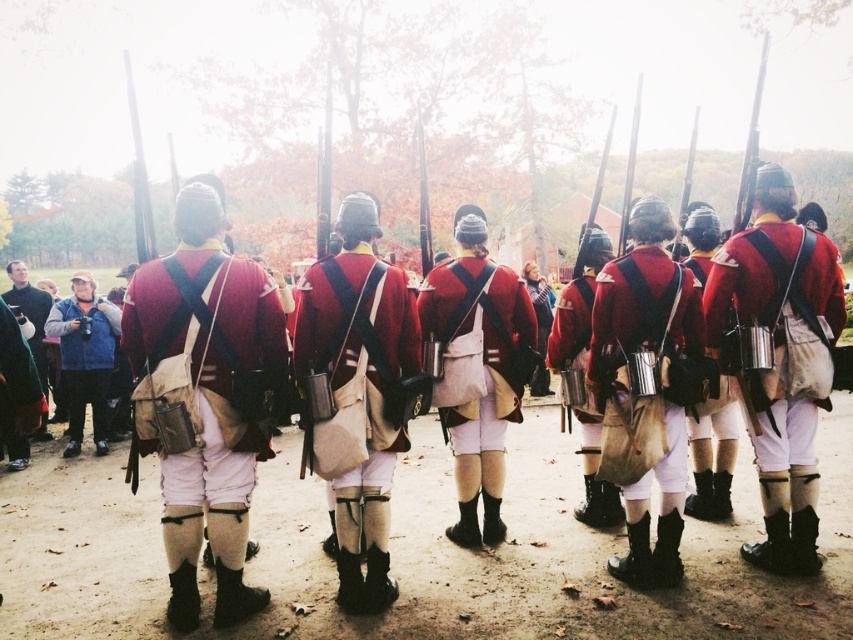
Question: Among these objects, which one is nearest to the camera?

Choices:
 (A) matte red fabric uniform at center
 (B) blue fabric vest at left
 (C) matte red cloth uniform at center
 (D) matte red uniform at center

Answer: (A)

Question: Which point is farther to the camera?

Choices:
 (A) blue fabric vest at left
 (B) matte red uniform at center

Answer: (A)

Question: Does blue fabric vest at left appear under matte leather canteen at center?

Choices:
 (A) yes
 (B) no

Answer: (A)

Question: Does matte red fabric uniform at center come behind matte red cloth uniform at center?

Choices:
 (A) yes
 (B) no

Answer: (B)

Question: Does matte red fabric uniform at center appear on the right side of matte red cloth uniform at center?

Choices:
 (A) no
 (B) yes

Answer: (A)

Question: Which point appears closest to the camera in this image?

Choices:
 (A) (74, 368)
 (B) (759, 301)
 (C) (663, 468)

Answer: (C)